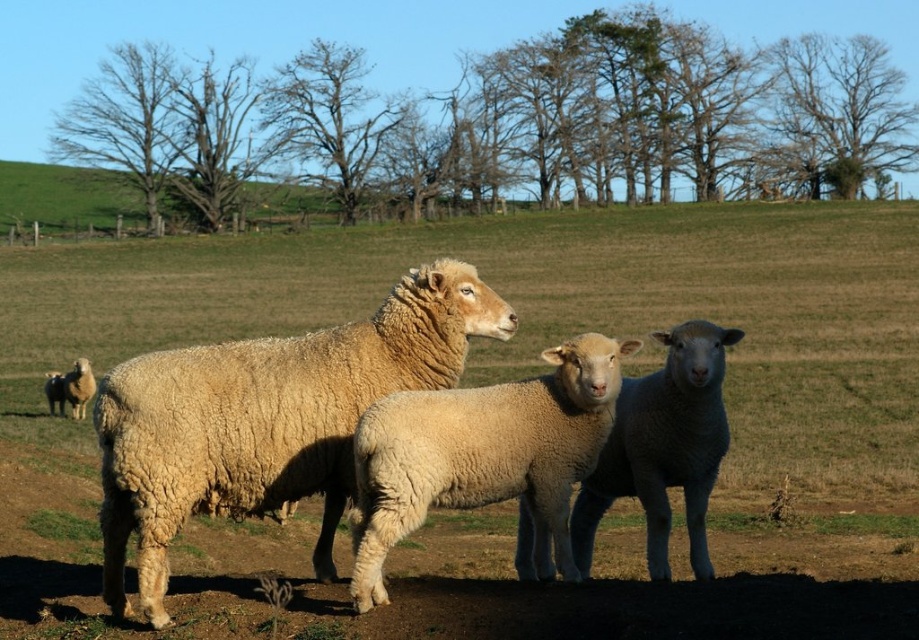
Between fuzzy woolen lamb at center and white woolen sheep at center, which one appears on the right side from the viewer's perspective?

white woolen sheep at center

Does fuzzy woolen lamb at center appear under white woolen sheep at center?

Actually, fuzzy woolen lamb at center is above white woolen sheep at center.

Where is `fuzzy woolen lamb at center`? This screenshot has height=640, width=919. fuzzy woolen lamb at center is located at coordinates (483, 456).

Does green soft grass at center have a greater width compared to white woolen sheep at center?

Yes.

Does green soft grass at center appear under white woolen sheep at center?

No, green soft grass at center is not below white woolen sheep at center.

Who is more forward, (221, 296) or (679, 460)?

Point (679, 460) is in front.

Where is `green soft grass at center`? This screenshot has width=919, height=640. green soft grass at center is located at coordinates (519, 355).

What do you see at coordinates (268, 419) in the screenshot? This screenshot has height=640, width=919. I see `golden woolen sheep at center` at bounding box center [268, 419].

Is point (157, 467) positioned before point (690, 532)?

Yes, it is.

Identify the location of golden woolen sheep at center. The width and height of the screenshot is (919, 640). (268, 419).